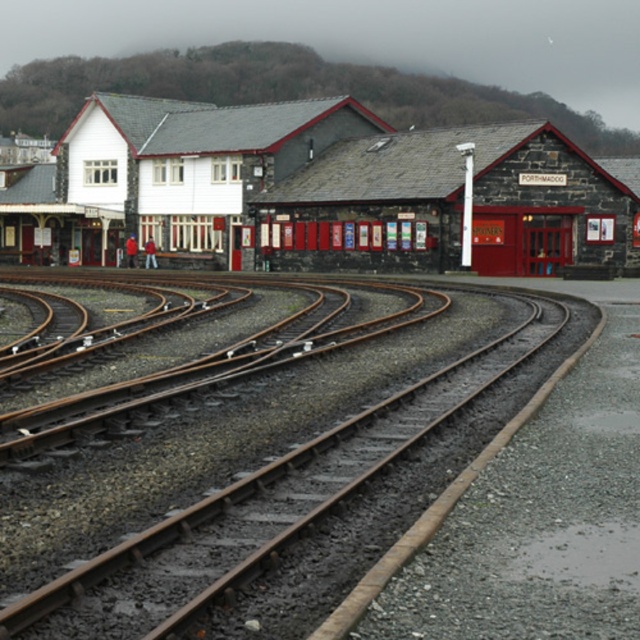
Does stone brick railway station at center have a smaller size compared to brown metallic tracks at center?

No, stone brick railway station at center is not smaller than brown metallic tracks at center.

From the picture: Is stone brick railway station at center positioned at the back of brown metallic tracks at center?

Yes, it is.

The height and width of the screenshot is (640, 640). What do you see at coordinates (324, 192) in the screenshot? I see `stone brick railway station at center` at bounding box center [324, 192].

I want to click on stone brick railway station at center, so click(x=324, y=192).